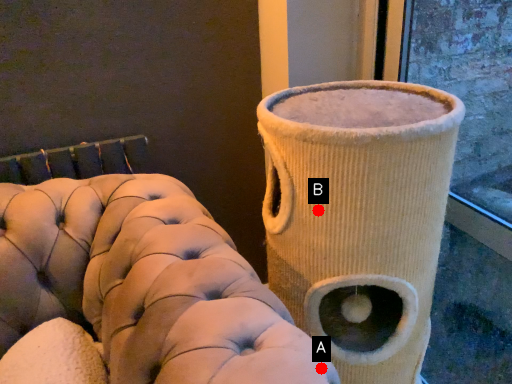
Question: Two points are circled on the image, labeled by A and B beside each circle. Which point is closer to the camera?

Choices:
 (A) A is closer
 (B) B is closer

Answer: (A)